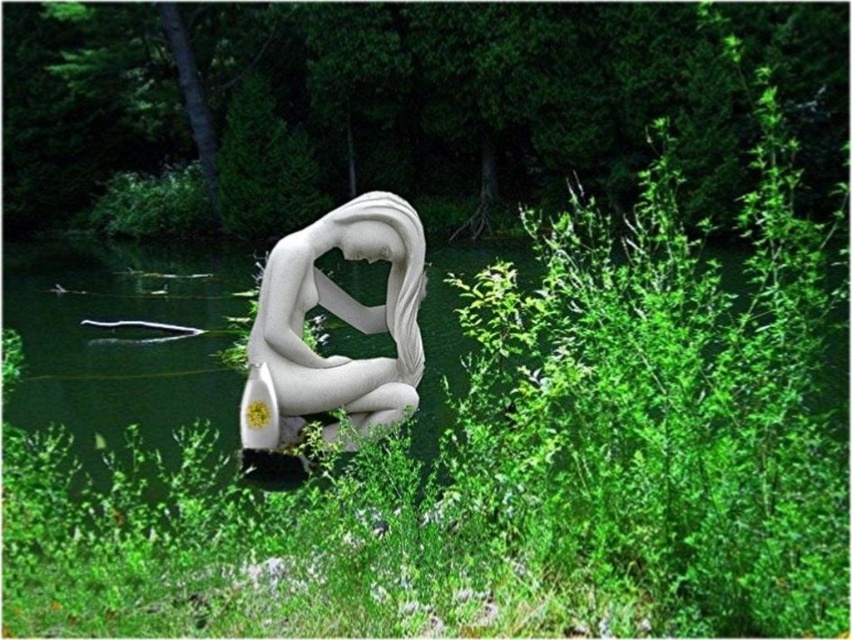
You are a landscape architect designing a garden pathway that needs to pass between the green leafy shrubs at center and the white marble statue at center. Based on their heights, which one should you consider for clearance requirements?

The green leafy shrubs at center are taller than the white marble statue at center, so clearance requirements should prioritize the height of the green leafy shrubs at center to ensure the pathway accommodates their greater height.

You are a landscape architect designing a walking path that must pass between the green leafy shrubs at center and the white marble statue at center. The path needs to be at least 10 feet wide to accommodate visitors. Based on the distance between these two objects, can the path be safely constructed without encroaching on either the shrubs or the statue?

The green leafy shrubs at center is 41.12 feet away from the white marble statue at center. Since the required path width is only 10 feet, there is ample space between them to construct the path without disturbing either object. The distance allows for a 10ft path plus additional buffer zones on both sides if needed.